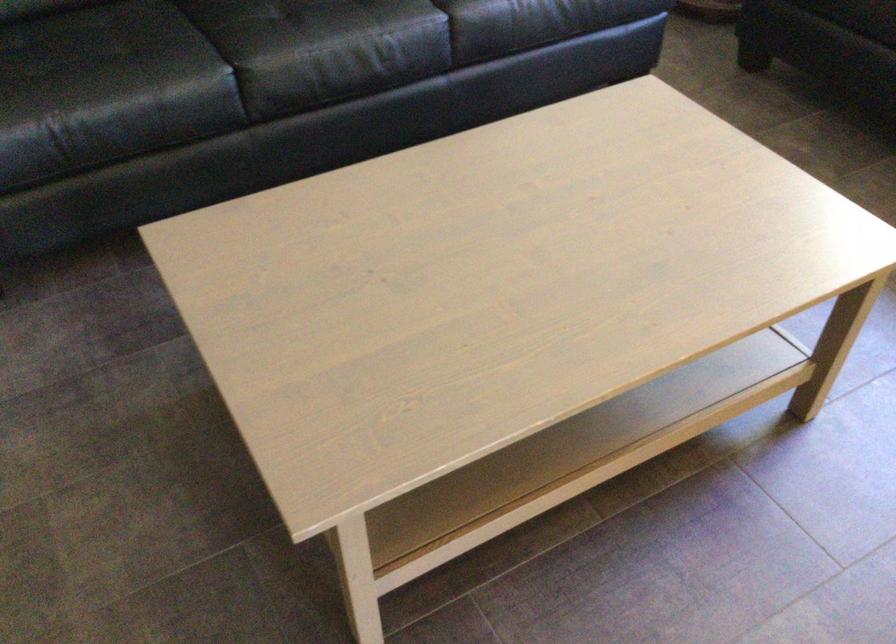
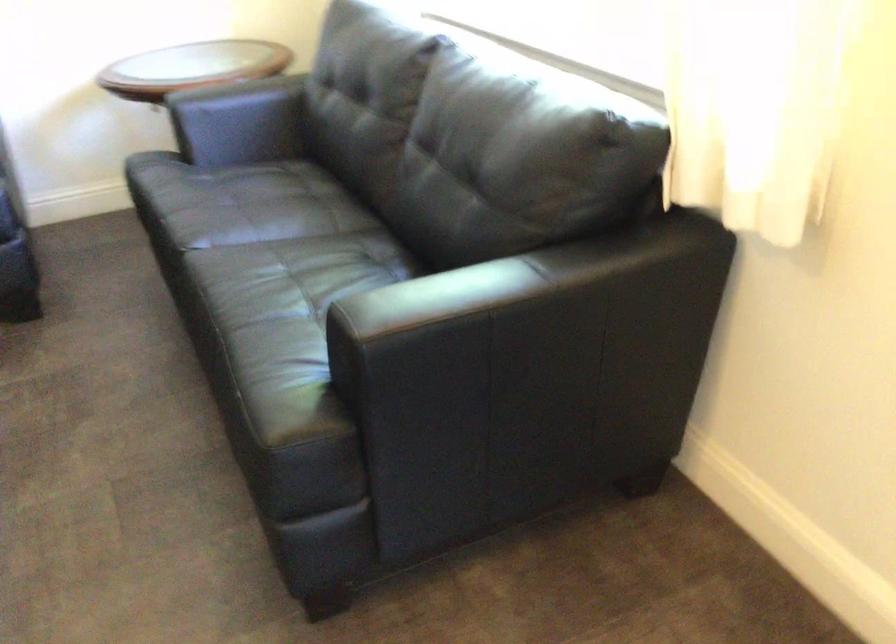
Question: What movement of the cameraman would produce the second image?

Choices:
 (A) Left
 (B) Right
 (C) Forward
 (D) Backward

Answer: (B)